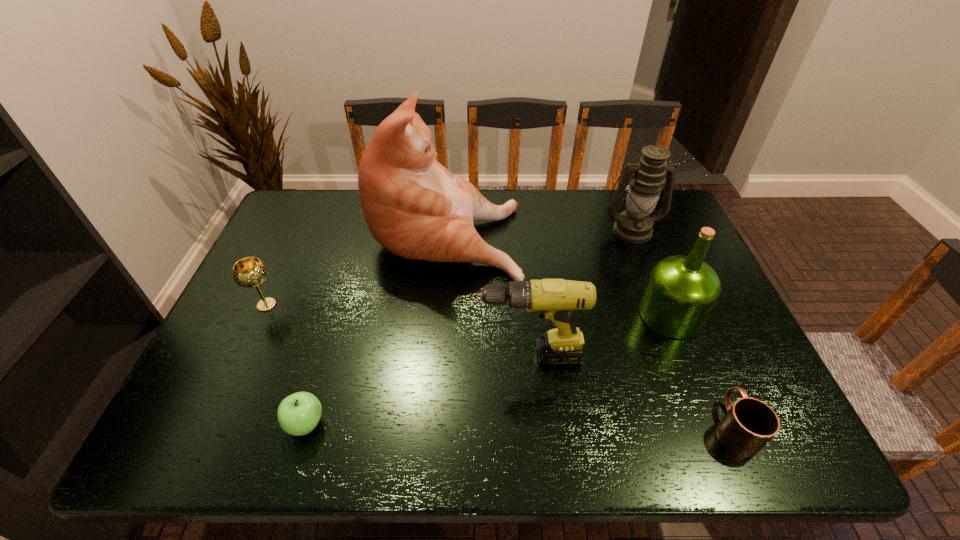
At what (x,y) coordinates should I click in order to perform the action: click on free area in between the chalice and the apple. Please return your answer as a coordinate pair (x, y). The width and height of the screenshot is (960, 540). Looking at the image, I should click on (286, 364).

I want to click on the third closest object relative to the oil lamp, so click(x=554, y=299).

Find the location of `object that is the fourth closest to the oil lamp`. object that is the fourth closest to the oil lamp is located at coordinates (749, 424).

Identify the location of vacant area in the image that satisfies the following two spatial constraints: 1. on the face of the tallest object; 2. on the side of the mug with the handle. This screenshot has height=540, width=960. (430, 427).

Locate an element on the screen. The height and width of the screenshot is (540, 960). free point that satisfies the following two spatial constraints: 1. on the side of the mug with the handle; 2. on the face of the tallest object is located at coordinates point(651,233).

Where is `vacant point that satisfies the following two spatial constraints: 1. on the face of the cat; 2. on the right side of the olive oil`? This screenshot has height=540, width=960. vacant point that satisfies the following two spatial constraints: 1. on the face of the cat; 2. on the right side of the olive oil is located at coordinates (440, 315).

Where is `vacant region that satisfies the following two spatial constraints: 1. on the face of the cat; 2. on the front side of the apple`? vacant region that satisfies the following two spatial constraints: 1. on the face of the cat; 2. on the front side of the apple is located at coordinates (430, 424).